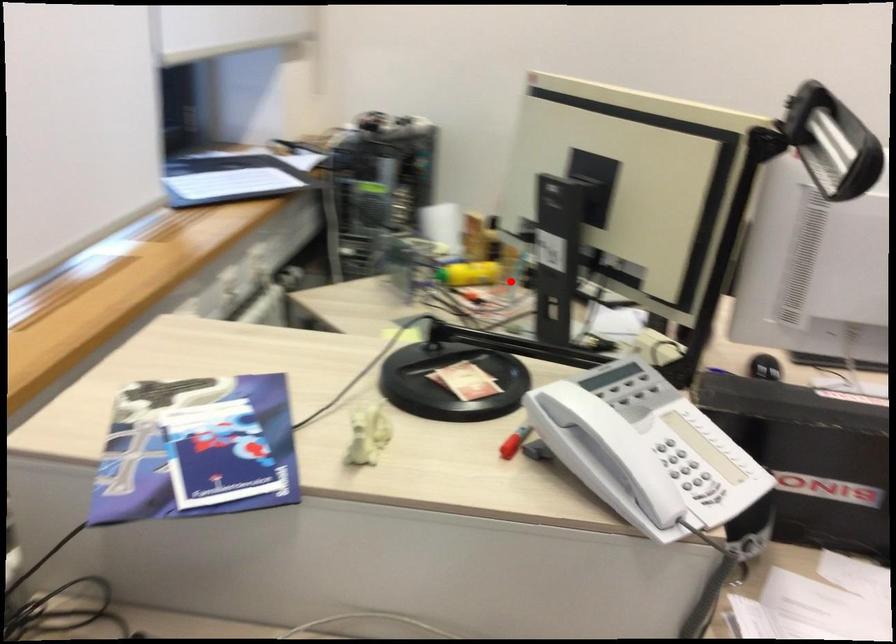
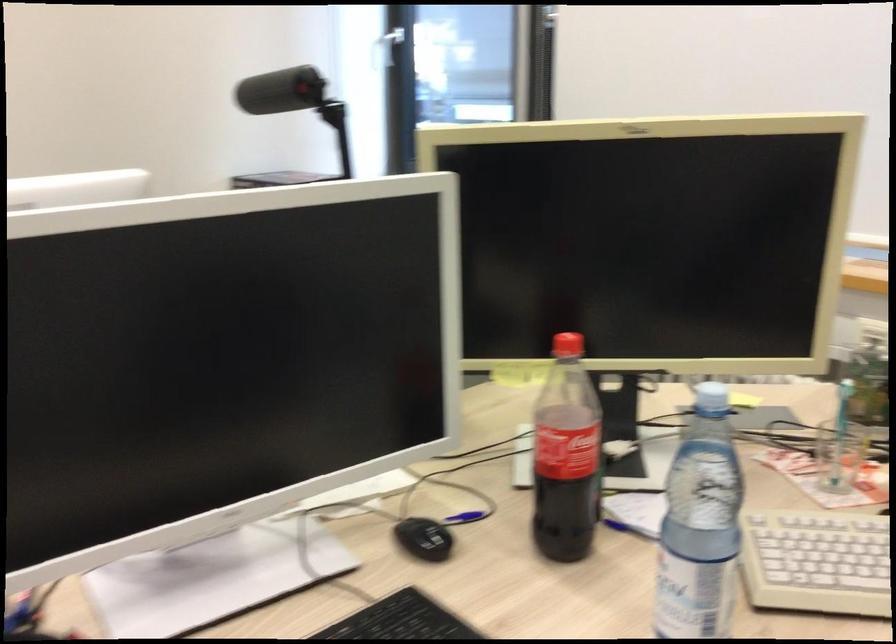
Question: I am providing you with two images of the same scene from different viewpoints. A red point is shown in image1. For the corresponding object point in image2, is it positioned nearer or farther from the camera?

Choices:
 (A) Nearer
 (B) Farther

Answer: (A)